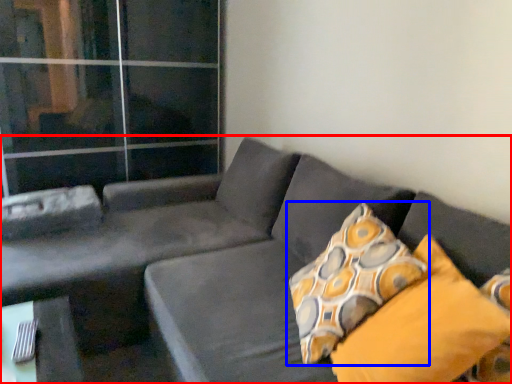
Question: Which of the following is the closest to the observer, studio couch (highlighted by a red box) or pillow (highlighted by a blue box)?

Choices:
 (A) studio couch
 (B) pillow

Answer: (A)